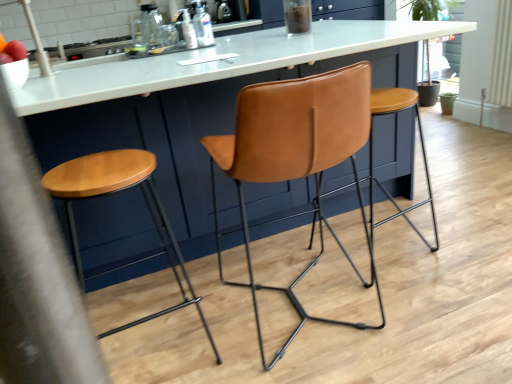
The image size is (512, 384). I want to click on vacant area located to the right-hand side of leather stool at center, the 1th stool in the right-to-left sequence, so click(456, 236).